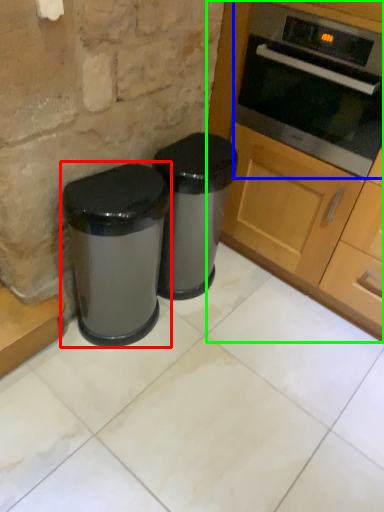
Question: Which object is the closest to the waste container (highlighted by a red box)? Choose among these: oven (highlighted by a blue box) or cabinetry (highlighted by a green box).

Choices:
 (A) oven
 (B) cabinetry

Answer: (B)